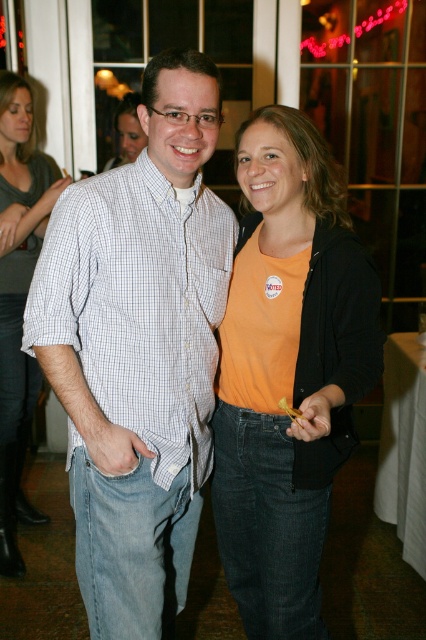
Question: Based on their relative distances, which object is farther from the orange matte shirt at center?

Choices:
 (A) matte orange shirt at center
 (B) white checkered shirt at center
 (C) matte gray shirt at upper left

Answer: (A)

Question: Is orange matte shirt at center thinner than matte gray shirt at upper left?

Choices:
 (A) no
 (B) yes

Answer: (A)

Question: Which point appears closest to the camera in this image?

Choices:
 (A) (181, 451)
 (B) (144, 141)

Answer: (A)

Question: Can you confirm if orange matte shirt at center is positioned to the right of matte gray shirt at upper left?

Choices:
 (A) no
 (B) yes

Answer: (B)

Question: Which point is farther from the camera taking this photo?

Choices:
 (A) (265, 248)
 (B) (138, 132)
 (C) (54, 340)

Answer: (B)

Question: Can you confirm if white checkered shirt at center is smaller than matte gray shirt at upper left?

Choices:
 (A) yes
 (B) no

Answer: (A)